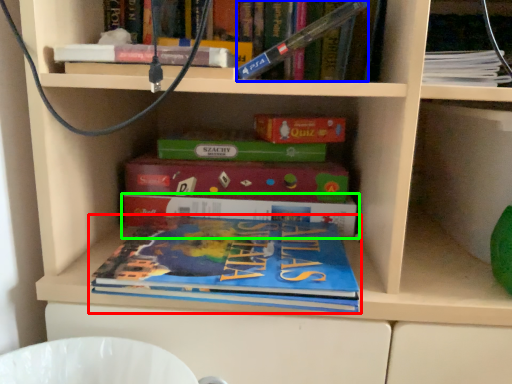
Question: Which object is positioned farthest from book (highlighted by a red box)? Select from book (highlighted by a blue box) and book (highlighted by a green box).

Choices:
 (A) book
 (B) book

Answer: (A)